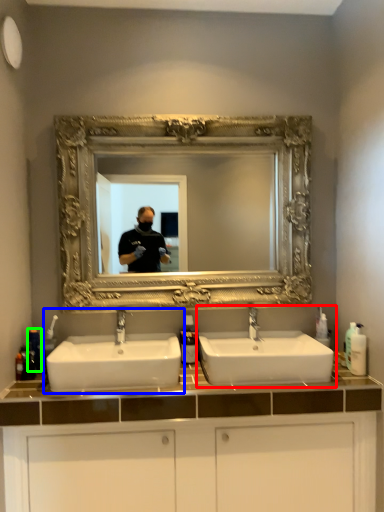
Question: Which object is the closest to the sink (highlighted by a red box)? Choose among these: sink (highlighted by a blue box) or toiletry (highlighted by a green box).

Choices:
 (A) sink
 (B) toiletry

Answer: (A)